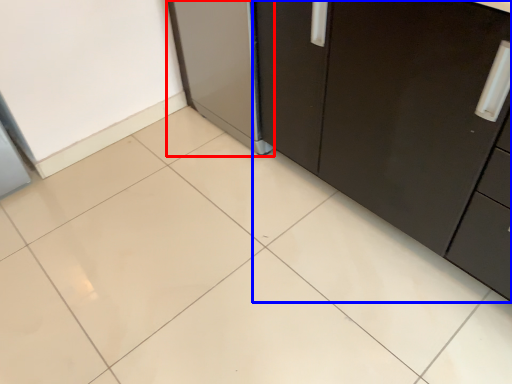
Question: Which object is closer to the camera taking this photo, appliance (highlighted by a red box) or cabinetry (highlighted by a blue box)?

Choices:
 (A) appliance
 (B) cabinetry

Answer: (B)